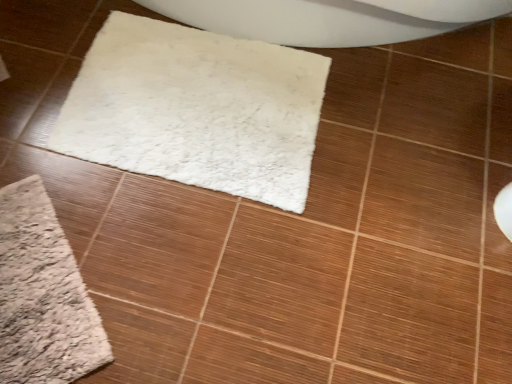
In order to click on vacant point above white fluffy mat at center (from a real-world perspective) in this screenshot , I will do `click(208, 98)`.